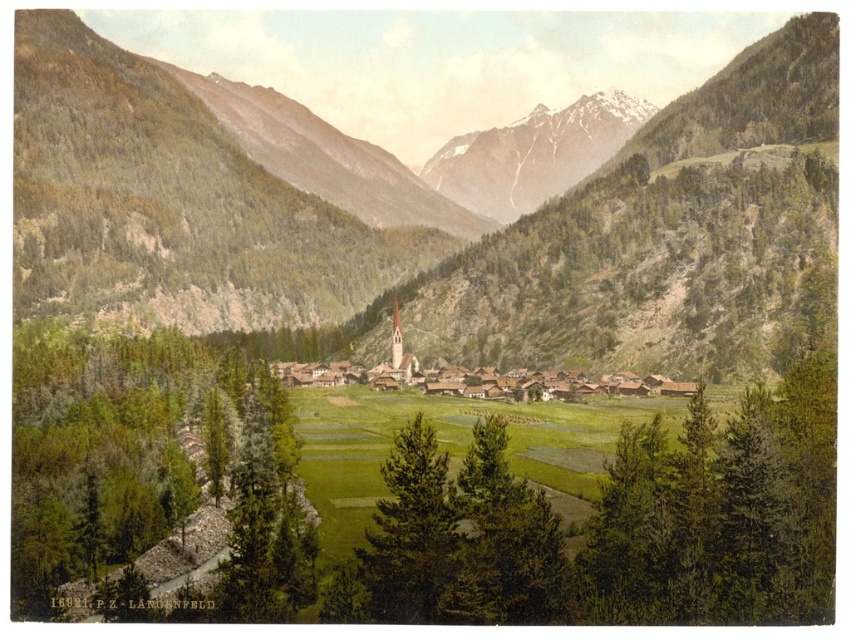
Question: Is green textured tree at center to the right of snowy granite mountain at upper center from the viewer's perspective?

Choices:
 (A) yes
 (B) no

Answer: (B)

Question: Which object is positioned closest to the green textured tree at left?

Choices:
 (A) green textured tree at center
 (B) wooden houses at center
 (C) snowy granite mountain at upper center
 (D) green grassy field at center

Answer: (A)

Question: Which is farther from the wooden houses at center?

Choices:
 (A) green textured tree at center
 (B) green textured tree at left
 (C) snowy granite mountain at upper center

Answer: (C)

Question: Which object appears farthest from the camera in this image?

Choices:
 (A) green textured tree at left
 (B) snowy granite mountain at upper center

Answer: (B)

Question: Does green grassy field at center have a lesser width compared to wooden houses at center?

Choices:
 (A) no
 (B) yes

Answer: (A)

Question: Can you confirm if green textured tree at center is thinner than snowy granite mountain at upper center?

Choices:
 (A) no
 (B) yes

Answer: (B)